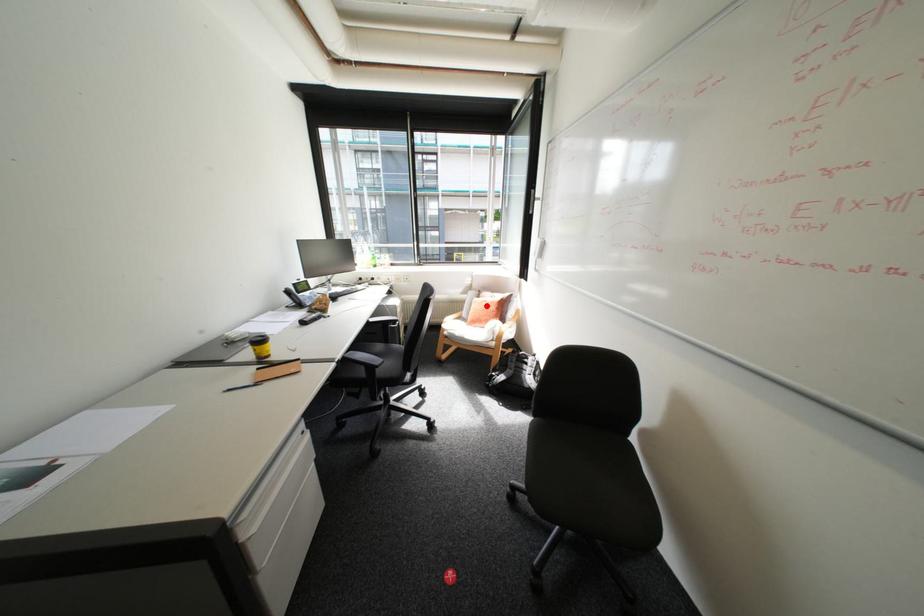
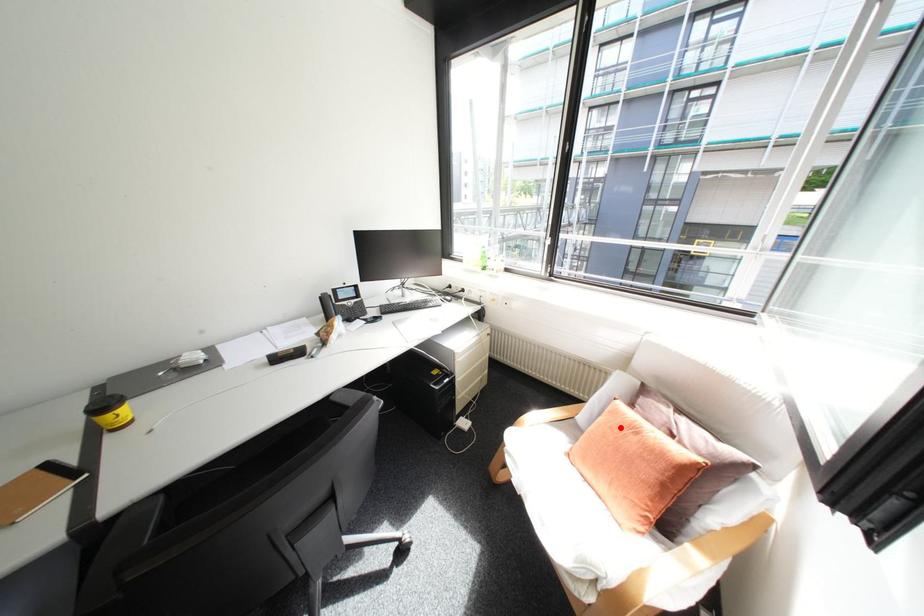
I am providing you with two images of the same scene from different viewpoints. A red point is marked on the first image and another point is marked on the second image. Does the point marked in image1 correspond to the same location as the one in image2?

Yes